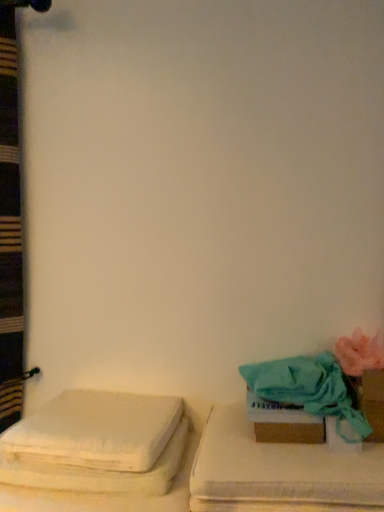
Question: Should I look upward or downward to see teal fabric cushion at right, which is the 1th furniture in right-to-left order?

Choices:
 (A) up
 (B) down

Answer: (B)

Question: From a real-world perspective, is brown cardboard box at lower right positioned over pink fabric flower at right based on gravity?

Choices:
 (A) yes
 (B) no

Answer: (B)

Question: Does brown cardboard box at lower right have a smaller size compared to pink fabric flower at right?

Choices:
 (A) yes
 (B) no

Answer: (A)

Question: Considering the relative sizes of brown cardboard box at lower right and pink fabric flower at right in the image provided, is brown cardboard box at lower right wider than pink fabric flower at right?

Choices:
 (A) yes
 (B) no

Answer: (B)

Question: Is pink fabric flower at right inside brown cardboard box at lower right?

Choices:
 (A) no
 (B) yes

Answer: (A)

Question: Can you confirm if brown cardboard box at lower right is shorter than pink fabric flower at right?

Choices:
 (A) yes
 (B) no

Answer: (B)

Question: From the image's perspective, is brown cardboard box at lower right below pink fabric flower at right?

Choices:
 (A) yes
 (B) no

Answer: (A)

Question: Can we say pink fabric flower at right lies outside brown cardboard box at lower right?

Choices:
 (A) yes
 (B) no

Answer: (A)

Question: Would you say pink fabric flower at right contains brown cardboard box at lower right?

Choices:
 (A) yes
 (B) no

Answer: (B)

Question: Is pink fabric flower at right positioned with its back to brown cardboard box at lower right?

Choices:
 (A) no
 (B) yes

Answer: (A)

Question: From a real-world perspective, is pink fabric flower at right under brown cardboard box at lower right?

Choices:
 (A) no
 (B) yes

Answer: (A)

Question: Can you confirm if pink fabric flower at right is wider than brown cardboard box at lower right?

Choices:
 (A) yes
 (B) no

Answer: (A)

Question: Is pink fabric flower at right aimed at brown cardboard box at lower right?

Choices:
 (A) no
 (B) yes

Answer: (A)

Question: Is pink fabric flower at right shorter than teal fabric towel at lower right?

Choices:
 (A) yes
 (B) no

Answer: (A)